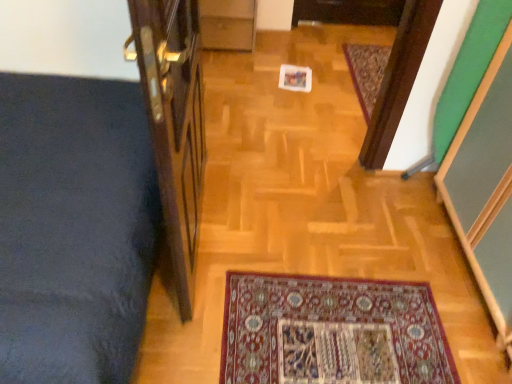
At what (x,y) coordinates should I click in order to perform the action: click on free region under wooden door at left (from a real-world perspective). Please return your answer as a coordinate pair (x, y). The image size is (512, 384). Looking at the image, I should click on (199, 233).